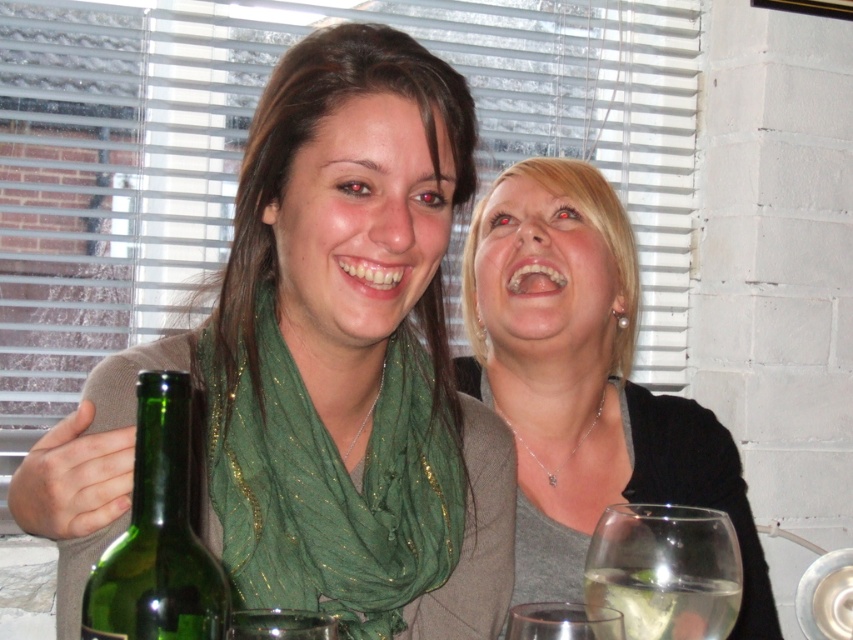
Is green sheer scarf at center to the right of matte black top at center from the viewer's perspective?

In fact, green sheer scarf at center is to the left of matte black top at center.

Who is lower down, green sheer scarf at center or matte black top at center?

matte black top at center is below.

At what (x,y) coordinates should I click in order to perform the action: click on green sheer scarf at center. Please return your answer as a coordinate pair (x, y). The width and height of the screenshot is (853, 640). Looking at the image, I should click on (322, 369).

Describe the element at coordinates (584, 381) in the screenshot. I see `matte black top at center` at that location.

Is matte black top at center further to the viewer compared to green glass bottle at left?

Yes, it is.

Is point (572, 170) positioned behind point (80, 611)?

That is True.

The image size is (853, 640). In order to click on matte black top at center in this screenshot , I will do `click(584, 381)`.

The image size is (853, 640). Identify the location of green shimmering scarf at center. (331, 483).

Between green shimmering scarf at center and green glass bottle at left, which one has less height?

green glass bottle at left is shorter.

The image size is (853, 640). Find the location of `green shimmering scarf at center`. green shimmering scarf at center is located at coordinates [x=331, y=483].